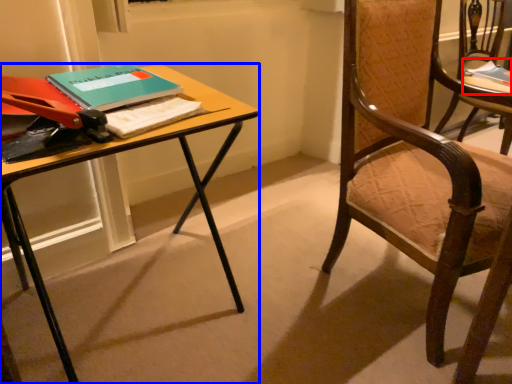
Question: Which of the following is the closest to the observer, book (highlighted by a red box) or desk (highlighted by a blue box)?

Choices:
 (A) book
 (B) desk

Answer: (B)